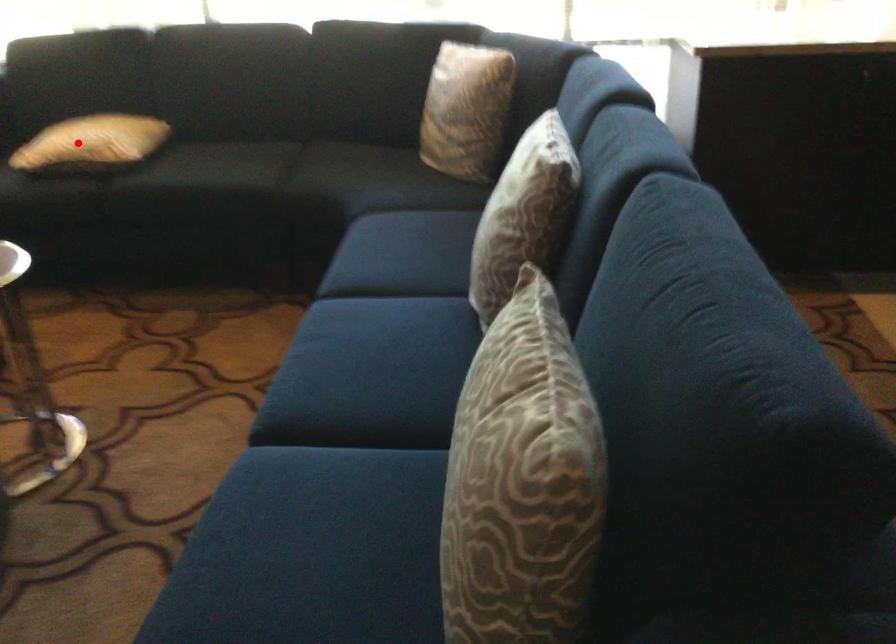
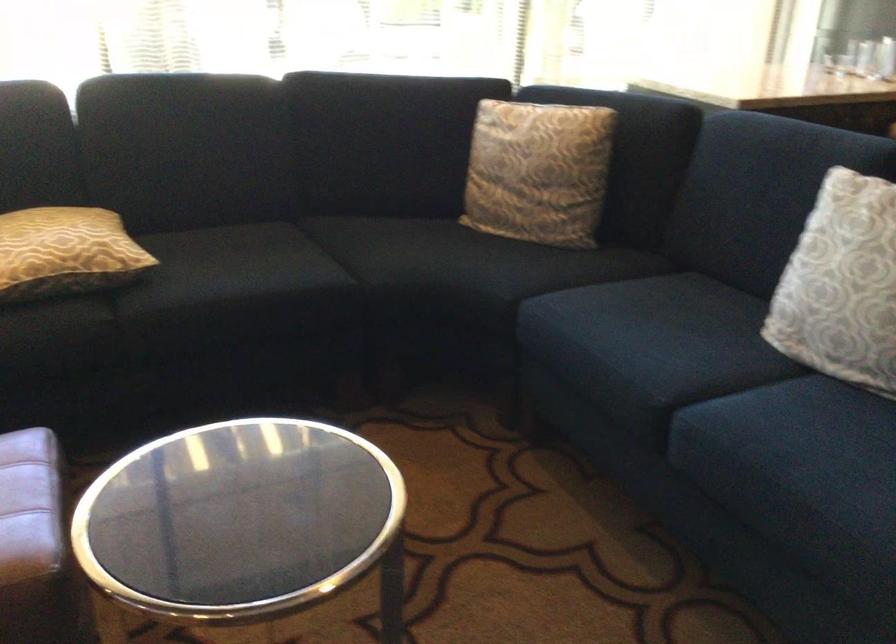
Question: A red point is marked in image1. In image2, is the corresponding 3D point closer to the camera or farther? Reply with the corresponding letter.

Choices:
 (A) The corresponding 3D point is closer.
 (B) The corresponding 3D point is farther.

Answer: (A)